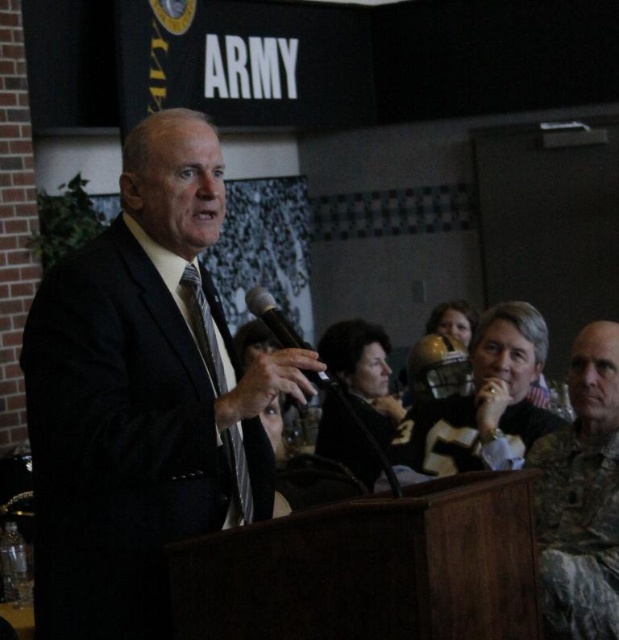
Is dark suit at center shorter than matte black tie at center?

No.

Consider the image. Between dark suit at center and matte black tie at center, which one has less height?

Standing shorter between the two is matte black tie at center.

Which is behind, point (210, 298) or point (249, 522)?

Positioned behind is point (210, 298).

You are a GUI agent. You are given a task and a screenshot of the screen. Output one action in this format:
    pyautogui.click(x=<x>, y=<y>)
    Task: Click on the dark suit at center
    This screenshot has height=640, width=619.
    Given the screenshot: What is the action you would take?
    pyautogui.click(x=142, y=396)

Is camouflage uniform at center to the right of black matte microphone at center from the viewer's perspective?

Correct, you'll find camouflage uniform at center to the right of black matte microphone at center.

Is camouflage uniform at center shorter than black matte microphone at center?

No.

Does point (410, 444) come behind point (256, 314)?

Yes, point (410, 444) is behind point (256, 314).

Find the location of a particular element. Image resolution: width=619 pixels, height=640 pixels. camouflage uniform at center is located at coordinates (483, 403).

Is point (563, 602) less distant than point (444, 412)?

Yes, point (563, 602) is in front of point (444, 412).

Between point (594, 554) and point (420, 435), which one is positioned behind?

Point (420, 435)

You are a GUI agent. You are given a task and a screenshot of the screen. Output one action in this format:
    pyautogui.click(x=<x>, y=<y>)
    Task: Click on the camouflage uniform at right
    The height and width of the screenshot is (640, 619).
    Given the screenshot: What is the action you would take?
    pyautogui.click(x=581, y=497)